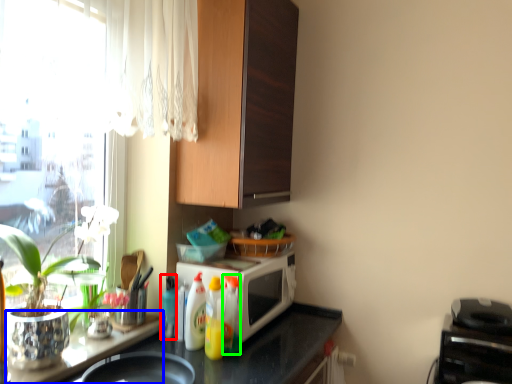
Question: Considering the real-world distances, which object is farthest from bottle (highlighted by a red box)? table (highlighted by a blue box) or bottle (highlighted by a green box)?

Choices:
 (A) table
 (B) bottle

Answer: (B)